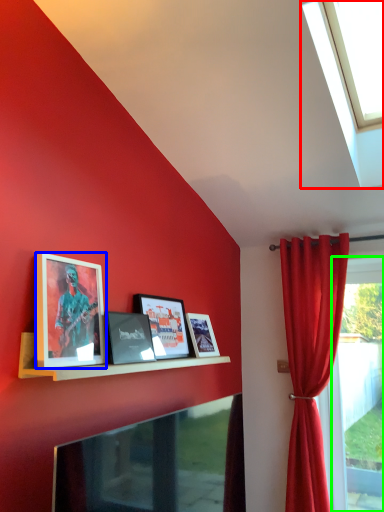
Question: Which object is positioned closest to window (highlighted by a red box)? Select from picture frame (highlighted by a blue box) and window frame (highlighted by a green box).

Choices:
 (A) picture frame
 (B) window frame

Answer: (A)